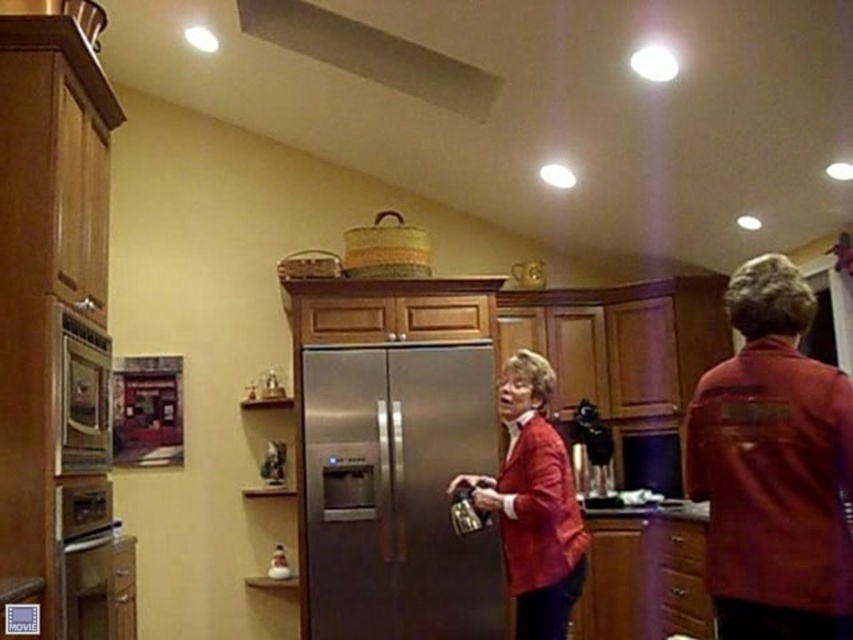
Is stainless steel refrigerator at center in front of stainless steel oven at left?

No, it is not.

Measure the distance between stainless steel refrigerator at center and stainless steel oven at left.

The distance of stainless steel refrigerator at center from stainless steel oven at left is 6.76 feet.

Is point (334, 512) farther from camera compared to point (68, 429)?

Yes, point (334, 512) is farther from viewer.

The image size is (853, 640). Find the location of `stainless steel refrigerator at center`. stainless steel refrigerator at center is located at coordinates (397, 492).

Can you confirm if matte red jacket at center is wider than stainless steel oven at left?

Yes, matte red jacket at center is wider than stainless steel oven at left.

How distant is matte red jacket at center from stainless steel oven at left?

A distance of 2.20 meters exists between matte red jacket at center and stainless steel oven at left.

Locate an element on the screen. This screenshot has width=853, height=640. matte red jacket at center is located at coordinates (773, 467).

What do you see at coordinates (532, 502) in the screenshot? Image resolution: width=853 pixels, height=640 pixels. I see `matte red blazer at center` at bounding box center [532, 502].

Can you confirm if matte red blazer at center is positioned to the left of white matte exhaust hood at upper center?

In fact, matte red blazer at center is to the right of white matte exhaust hood at upper center.

Where is `matte red blazer at center`? matte red blazer at center is located at coordinates (532, 502).